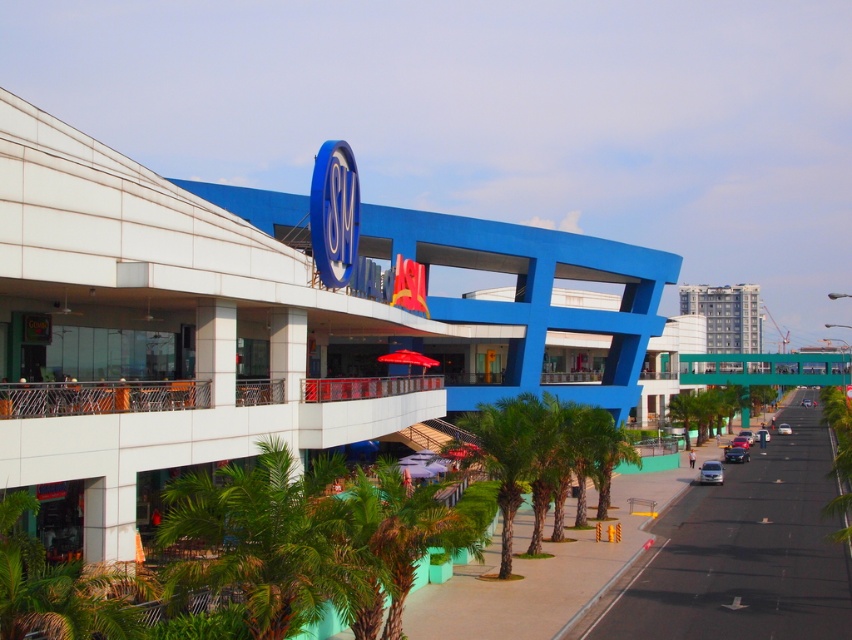
You are standing at the entrance of the SM Supermalls building and want to find the palm tree located at point [508,456]. Which direction should you look to find it?

The green leafy palm tree at center is located at point [508,456], so you should look straight ahead to find it.

You are standing in front of the shopping mall and want to take a photo of both the point at coordinates (756,337) and the point at coordinates (707,477). Which point will appear closer to the bottom of the photo?

Point (707,477) will appear closer to the bottom of the photo because it is closer to the camera than point (756,337).